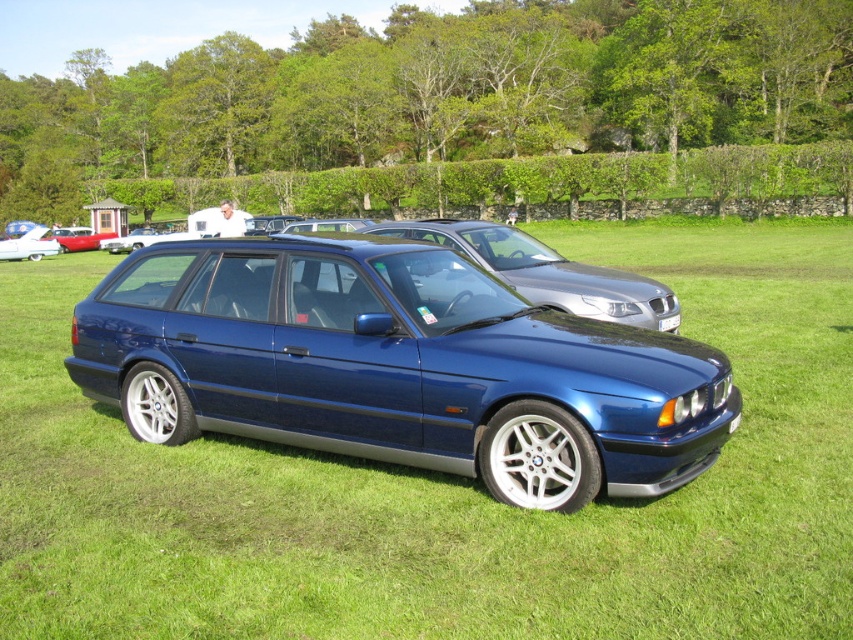
You are standing at the origin point of the coordinate system where the image is displayed. The metallic blue station wagon at center is located at point (x=398, y=365). If you want to walk towards the metallic blue station wagon at center, which direction should you move in?

To reach the metallic blue station wagon at center located at point (x=398, y=365) from the origin, you should move towards the northeast direction since the coordinates are positive in both x and y axes.